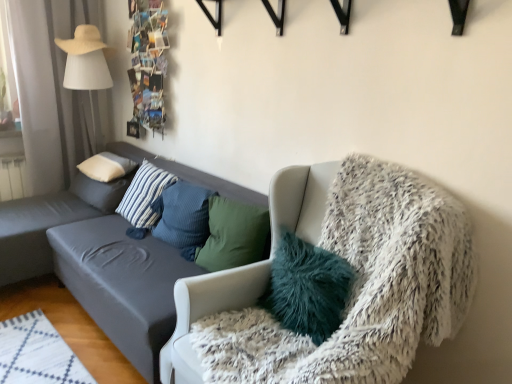
Measure the distance between point (158, 218) and camera.

The depth of point (158, 218) is 2.60 meters.

Describe the element at coordinates (97, 264) in the screenshot. I see `dark gray fabric couch at left` at that location.

Find the location of a particular element. This screenshot has width=512, height=384. blue striped pillow at center, which is counted as the third pillow, starting from the right is located at coordinates (144, 195).

From the image's perspective, is white fabric lampshade at left above or below white soft pillow at left, which is the 2th pillow from left to right?

Based on their image positions, white fabric lampshade at left is located above white soft pillow at left, which is the 2th pillow from left to right.

Where is `lamp located above the white soft pillow at left, which is the 2th pillow from left to right (from a real-world perspective)`? This screenshot has width=512, height=384. lamp located above the white soft pillow at left, which is the 2th pillow from left to right (from a real-world perspective) is located at coordinates (86, 62).

What's the angular difference between white fabric lampshade at left and white soft pillow at left, acting as the fourth pillow starting from the right,'s facing directions?

The facing directions of white fabric lampshade at left and white soft pillow at left, acting as the fourth pillow starting from the right, are 5.72 degrees apart.

Could you measure the distance between white fabric lampshade at left and white soft pillow at left, acting as the fourth pillow starting from the right?

white fabric lampshade at left and white soft pillow at left, acting as the fourth pillow starting from the right, are 26.20 inches apart from each other.

Considering the relative sizes of white soft pillow at left, which is the 2th pillow from left to right, and teal fluffy pillow at center, the 1th pillow when ordered from right to left, in the image provided, is white soft pillow at left, which is the 2th pillow from left to right, taller than teal fluffy pillow at center, the 1th pillow when ordered from right to left,?

In fact, white soft pillow at left, which is the 2th pillow from left to right, may be shorter than teal fluffy pillow at center, the 1th pillow when ordered from right to left.

Is point (93, 160) in front of point (332, 307)?

That is False.

Which object is positioned more to the right, white soft pillow at left, which is the 2th pillow from left to right, or teal fluffy pillow at center, the 1th pillow when ordered from right to left?

From the viewer's perspective, teal fluffy pillow at center, the 1th pillow when ordered from right to left, appears more on the right side.

Can you tell me how much white soft pillow at left, acting as the fourth pillow starting from the right, and dark gray fabric couch at left differ in facing direction?

The facing directions of white soft pillow at left, acting as the fourth pillow starting from the right, and dark gray fabric couch at left are 0.734 degrees apart.

Who is smaller, white soft pillow at left, which is the 2th pillow from left to right, or dark gray fabric couch at left?

white soft pillow at left, which is the 2th pillow from left to right.

Which object is wider, white soft pillow at left, which is the 2th pillow from left to right, or dark gray fabric couch at left?

With larger width is dark gray fabric couch at left.

Is white soft pillow at left, which is the 2th pillow from left to right, next to dark gray fabric couch at left?

white soft pillow at left, which is the 2th pillow from left to right, and dark gray fabric couch at left are not in contact.

Could you measure the distance between white soft pillow at upper left, the 1th pillow when ordered from left to right, and white fluffy chair at right?

A distance of 1.78 meters exists between white soft pillow at upper left, the 1th pillow when ordered from left to right, and white fluffy chair at right.

In the scene shown: From a real-world perspective, is white soft pillow at upper left, arranged as the fifth pillow when viewed from the right, above or below white fluffy chair at right?

Clearly, from a real-world perspective, white soft pillow at upper left, arranged as the fifth pillow when viewed from the right, is below white fluffy chair at right.

Does white soft pillow at upper left, the 1th pillow when ordered from left to right, have a lesser width compared to white fluffy chair at right?

Correct, the width of white soft pillow at upper left, the 1th pillow when ordered from left to right, is less than that of white fluffy chair at right.

Locate an element on the screen. the 4th pillow positioned above the white fluffy chair at right (from the image's perspective) is located at coordinates (103, 180).

Is blue striped pillow at center, which is counted as the third pillow, starting from the right, not inside blue textured pillow at center, the second pillow when ordered from right to left?

Yes.

Which is in front, blue striped pillow at center, the third pillow viewed from the left, or blue textured pillow at center, the second pillow when ordered from right to left?

blue textured pillow at center, the second pillow when ordered from right to left.

From a real-world perspective, count 1st pillows downward from the blue textured pillow at center, the second pillow when ordered from right to left, and point to it. Please provide its 2D coordinates.

[(144, 195)]

Based on the photo, is blue striped pillow at center, which is counted as the third pillow, starting from the right, placed right next to blue textured pillow at center, the second pillow when ordered from right to left?

No, blue striped pillow at center, which is counted as the third pillow, starting from the right, is not touching blue textured pillow at center, the second pillow when ordered from right to left.

Are blue striped pillow at center, which is counted as the third pillow, starting from the right, and dark gray fabric couch at left far apart?

No, blue striped pillow at center, which is counted as the third pillow, starting from the right, is not far away from dark gray fabric couch at left.

Is blue striped pillow at center, which is counted as the third pillow, starting from the right, spatially inside dark gray fabric couch at left, or outside of it?

blue striped pillow at center, which is counted as the third pillow, starting from the right, can be found inside dark gray fabric couch at left.

In the image, is blue striped pillow at center, which is counted as the third pillow, starting from the right, on the left side or the right side of dark gray fabric couch at left?

From the image, it's evident that blue striped pillow at center, which is counted as the third pillow, starting from the right, is to the left of dark gray fabric couch at left.

Between point (130, 214) and point (110, 254), which one is positioned in front?

The point (110, 254) is closer to the camera.

Does blue striped pillow at center, the third pillow viewed from the left, lie behind white fluffy chair at right?

Yes, it is behind white fluffy chair at right.

How much distance is there between blue striped pillow at center, which is counted as the third pillow, starting from the right, and white fluffy chair at right?

blue striped pillow at center, which is counted as the third pillow, starting from the right, and white fluffy chair at right are 1.28 meters apart.

From the image's perspective, would you say blue striped pillow at center, which is counted as the third pillow, starting from the right, is shown under white fluffy chair at right?

Actually, blue striped pillow at center, which is counted as the third pillow, starting from the right, appears above white fluffy chair at right in the image.

Is blue striped pillow at center, the third pillow viewed from the left, to the left of white fluffy chair at right from the viewer's perspective?

Indeed, blue striped pillow at center, the third pillow viewed from the left, is positioned on the left side of white fluffy chair at right.

Locate an element on the screen. The width and height of the screenshot is (512, 384). the 2nd pillow to the right when counting from the white fabric lampshade at left is located at coordinates (106, 167).

The image size is (512, 384). I want to click on pillow that is the 4th one when counting forward from the white soft pillow at left, which is the 2th pillow from left to right, so click(x=307, y=288).

Consider the image. Based on their spatial positions, is blue textured pillow at center, the second pillow when ordered from right to left, or white fluffy chair at right closer to white soft pillow at upper left, arranged as the fifth pillow when viewed from the right?

The object closer to white soft pillow at upper left, arranged as the fifth pillow when viewed from the right, is blue textured pillow at center, the second pillow when ordered from right to left.

Looking at the image, which one is located closer to blue striped pillow at center, which is counted as the third pillow, starting from the right, white soft pillow at left, acting as the fourth pillow starting from the right, or dark gray fabric couch at left?

The object closer to blue striped pillow at center, which is counted as the third pillow, starting from the right, is white soft pillow at left, acting as the fourth pillow starting from the right.

When comparing their distances from white fabric lampshade at left, does dark gray fabric couch at left or teal fluffy pillow at center, the 1th pillow when ordered from right to left, seem closer?

dark gray fabric couch at left is positioned closer to the anchor white fabric lampshade at left.

Based on their spatial positions, is blue textured pillow at center, which appears as the fourth pillow when viewed from the left, or teal fluffy pillow at center, the 1th pillow when ordered from right to left, further from white fluffy chair at right?

blue textured pillow at center, which appears as the fourth pillow when viewed from the left.

Based on their spatial positions, is white fabric lampshade at left or teal fluffy pillow at center, the 1th pillow when ordered from right to left, further from white fluffy chair at right?

Among the two, white fabric lampshade at left is located further to white fluffy chair at right.

Estimate the real-world distances between objects in this image. Which object is further from blue textured pillow at center, the second pillow when ordered from right to left, blue striped pillow at center, which is counted as the third pillow, starting from the right, or white fabric lampshade at left?

The object further to blue textured pillow at center, the second pillow when ordered from right to left, is white fabric lampshade at left.

Looking at this image, from the image, which object appears to be nearer to teal fluffy pillow at center, which appears as the fifth pillow when viewed from the left, white soft pillow at upper left, arranged as the fifth pillow when viewed from the right, or blue textured pillow at center, which appears as the fourth pillow when viewed from the left?

blue textured pillow at center, which appears as the fourth pillow when viewed from the left.

Which object lies further to the anchor point teal fluffy pillow at center, which appears as the fifth pillow when viewed from the left, blue textured pillow at center, which appears as the fourth pillow when viewed from the left, or white fluffy chair at right?

blue textured pillow at center, which appears as the fourth pillow when viewed from the left, is positioned further to the anchor teal fluffy pillow at center, which appears as the fifth pillow when viewed from the left.

The width and height of the screenshot is (512, 384). In order to click on pillow between white soft pillow at left, which is the 2th pillow from left to right, and blue textured pillow at center, which appears as the fourth pillow when viewed from the left, in the horizontal direction in this screenshot , I will do `click(144, 195)`.

Identify the location of pillow between dark gray fabric couch at left and blue striped pillow at center, the third pillow viewed from the left, along the z-axis. Image resolution: width=512 pixels, height=384 pixels. (183, 217).

Image resolution: width=512 pixels, height=384 pixels. I want to click on pillow located between teal fluffy pillow at center, which appears as the fifth pillow when viewed from the left, and blue striped pillow at center, the third pillow viewed from the left, in the depth direction, so pyautogui.click(x=183, y=217).

At what (x,y) coordinates should I click in order to perform the action: click on studio couch located between white fluffy chair at right and white soft pillow at left, acting as the fourth pillow starting from the right, in the depth direction. Please return your answer as a coordinate pair (x, y). The height and width of the screenshot is (384, 512). Looking at the image, I should click on (97, 264).